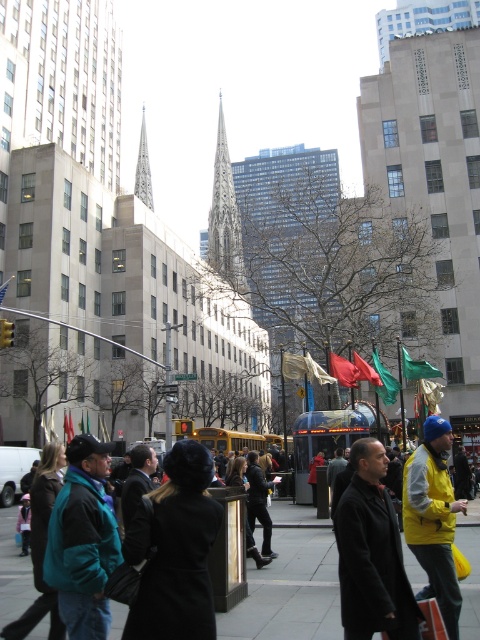
Question: Is carved stone spire at center smaller than silver metallic spire at center?

Choices:
 (A) yes
 (B) no

Answer: (B)

Question: Where is yellow fabric jacket at center-right located in relation to carved stone spire at center in the image?

Choices:
 (A) above
 (B) below

Answer: (B)

Question: Which of the following is the closest to the observer?

Choices:
 (A) silver metallic spire at center
 (B) yellow fabric jacket at center-right
 (C) carved stone spire at center
 (D) smooth concrete pavement at center

Answer: (B)

Question: Which of the following is the closest to the observer?

Choices:
 (A) (220, 163)
 (B) (468, 580)
 (C) (147, 177)
 (D) (437, 515)

Answer: (D)

Question: Does black matte coat at center appear over yellow fabric jacket at center-right?

Choices:
 (A) yes
 (B) no

Answer: (A)

Question: Which object is the closest to the black matte coat at center?

Choices:
 (A) black wool coat at center
 (B) smooth concrete pavement at center
 (C) teal fleece jacket at lower left
 (D) silver metallic spire at center

Answer: (A)